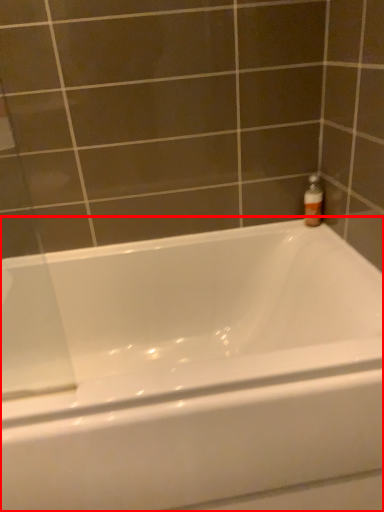
Question: Considering the relative positions of bathtub (annotated by the red box) and bottle in the image provided, where is bathtub (annotated by the red box) located with respect to the staircase?

Choices:
 (A) right
 (B) left

Answer: (B)